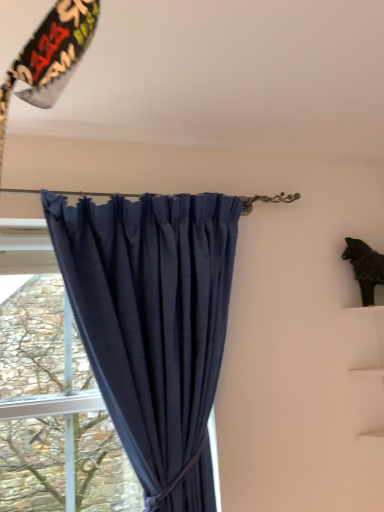
Question: Considering their positions, is green leafy tree at left located in front of or behind black matte cat at upper right?

Choices:
 (A) front
 (B) behind

Answer: (A)

Question: From a real-world perspective, relative to black matte cat at upper right, is green leafy tree at left vertically above or below?

Choices:
 (A) below
 (B) above

Answer: (A)

Question: Estimate the real-world distances between objects in this image. Which object is closer to the navy blue fabric curtain at center?

Choices:
 (A) black matte cat at upper right
 (B) green leafy tree at left

Answer: (B)

Question: Which of these objects is positioned farthest from the navy blue fabric curtain at center?

Choices:
 (A) green leafy tree at left
 (B) black matte cat at upper right

Answer: (B)